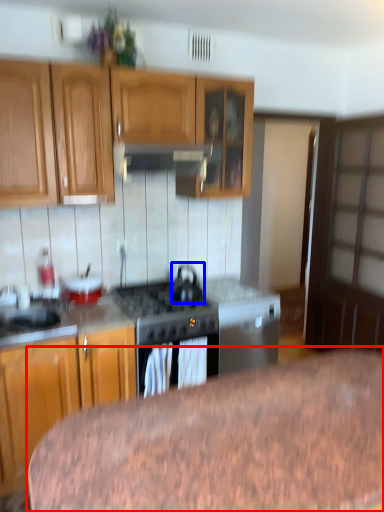
Question: Which of the following is the closest to the observer, table (highlighted by a red box) or kitchen appliance (highlighted by a blue box)?

Choices:
 (A) table
 (B) kitchen appliance

Answer: (A)